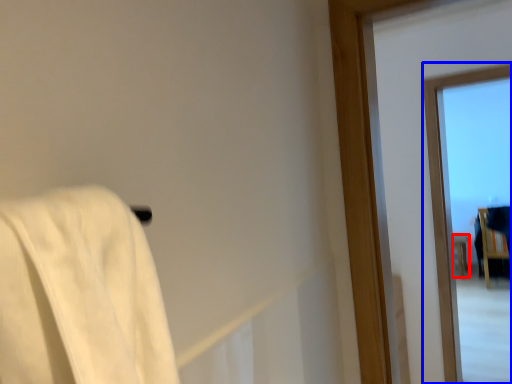
Question: Which point is further to the camera, furniture (highlighted by a red box) or window (highlighted by a blue box)?

Choices:
 (A) furniture
 (B) window

Answer: (A)